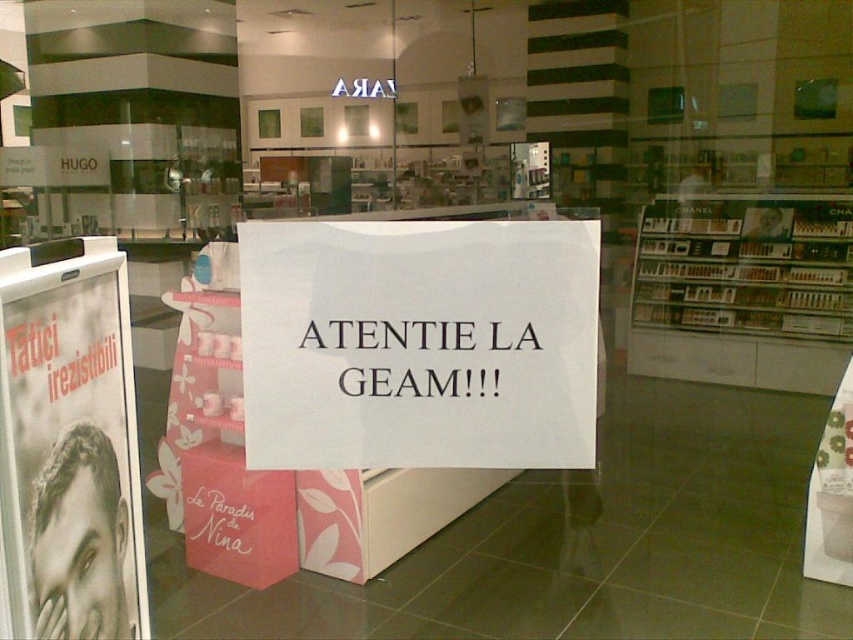
From the picture: Does white paper sign at center have a lesser width compared to black glossy poster at left?

Incorrect, white paper sign at center's width is not less than black glossy poster at left's.

Is white paper sign at center closer to camera compared to black glossy poster at left?

No, it is behind black glossy poster at left.

Which is in front, point (456, 380) or point (70, 289)?

Positioned in front is point (456, 380).

Identify the location of white paper sign at center. (419, 342).